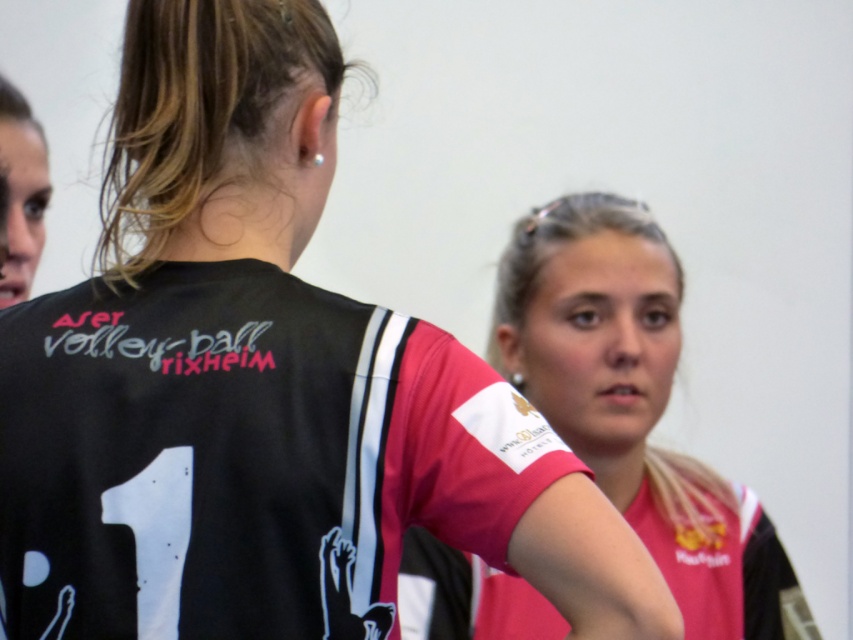
Between black jersey at center and pink jersey at center, which one is positioned lower?

Positioned lower is pink jersey at center.

Does point (55, 316) lie in front of point (689, 516)?

Yes, it is in front of point (689, 516).

At what (x,y) coordinates should I click in order to perform the action: click on black jersey at center. Please return your answer as a coordinate pair (x, y). Looking at the image, I should click on (242, 456).